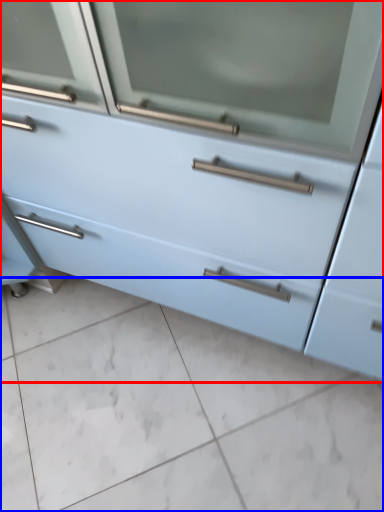
Question: Which object is further to the camera taking this photo, chest of drawers (highlighted by a red box) or ceramic tile (highlighted by a blue box)?

Choices:
 (A) chest of drawers
 (B) ceramic tile

Answer: (B)